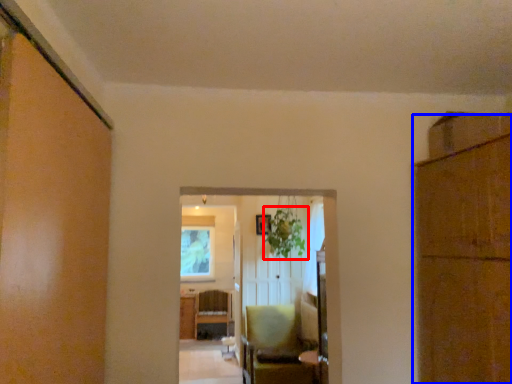
Question: Which object appears closest to the camera in this image, plant (highlighted by a red box) or cabinetry (highlighted by a blue box)?

Choices:
 (A) plant
 (B) cabinetry

Answer: (B)